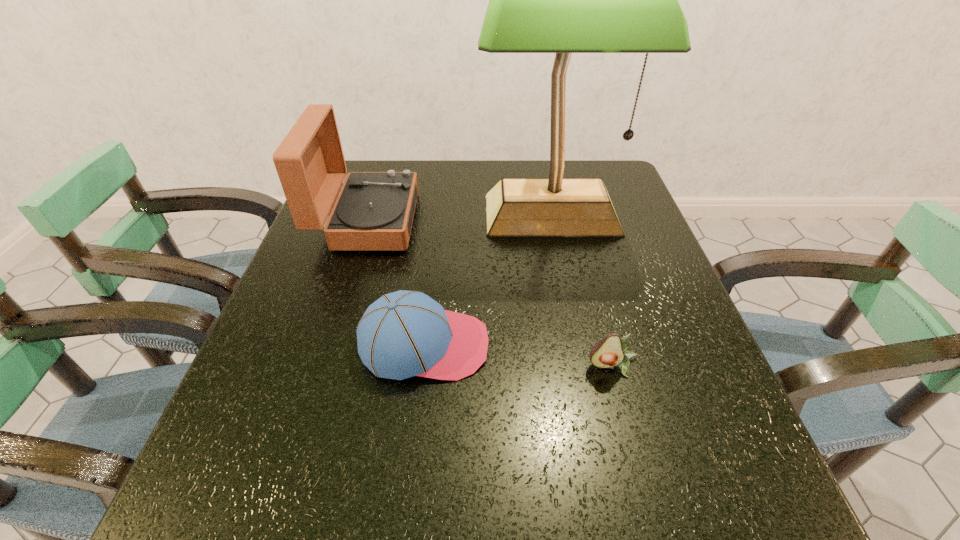
This screenshot has height=540, width=960. I want to click on object that stands as the closest to the avocado, so click(x=403, y=334).

Select which object appears as the closest to the avocado. Please provide its 2D coordinates. Your answer should be formatted as a tuple, i.e. [(x, y)], where the tuple contains the x and y coordinates of a point satisfying the conditions above.

[(403, 334)]

Image resolution: width=960 pixels, height=540 pixels. Find the location of `vacant position in the image that satisfies the following two spatial constraints: 1. on the metallic stand of the table lamp; 2. on the front-facing side of the baseball cap`. vacant position in the image that satisfies the following two spatial constraints: 1. on the metallic stand of the table lamp; 2. on the front-facing side of the baseball cap is located at coordinates (578, 345).

Image resolution: width=960 pixels, height=540 pixels. In order to click on vacant point that satisfies the following two spatial constraints: 1. on the metallic stand of the table lamp; 2. on the front-facing side of the baseball cap in this screenshot , I will do `click(578, 345)`.

Image resolution: width=960 pixels, height=540 pixels. I want to click on vacant space that satisfies the following two spatial constraints: 1. on the metallic stand of the table lamp; 2. on the front-facing side of the baseball cap, so click(578, 345).